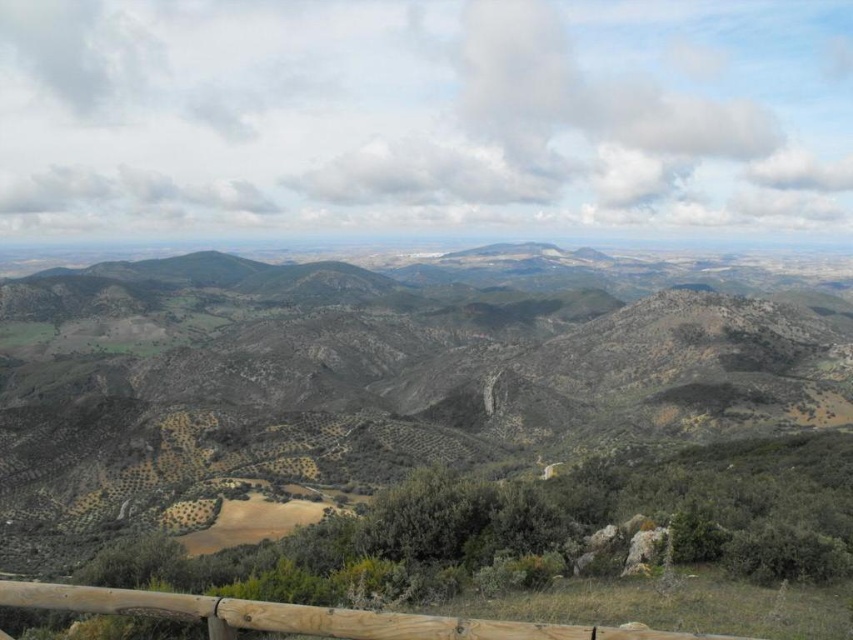
You are standing on a mountain viewpoint and want to take a photo that includes both the green grassy hillside at center and the brown wooden fence at lower center. Considering their sizes, which object will occupy more space in the photo?

The green grassy hillside at center will occupy more space in the photo because it has a larger size compared to the brown wooden fence at lower center.

You are standing at the viewpoint overlooking the mountainous landscape. You see the green grassy hillside at center and the brown wooden fence at lower center. Which object is closer to you?

The brown wooden fence at lower center is closer to you because it is positioned below the green grassy hillside at center.

You are standing at the viewpoint overlooking the mountainous landscape. You notice the green grassy hillside at center and the brown wooden fence at lower center. Which object is higher in elevation?

The green grassy hillside at center is much taller than the brown wooden fence at lower center, so it is higher in elevation.